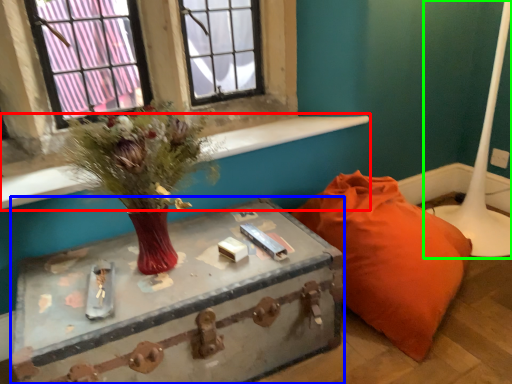
Question: Which object is positioned farthest from window sill (highlighted by a red box)? Select from table (highlighted by a blue box) and table lamp (highlighted by a green box).

Choices:
 (A) table
 (B) table lamp

Answer: (B)